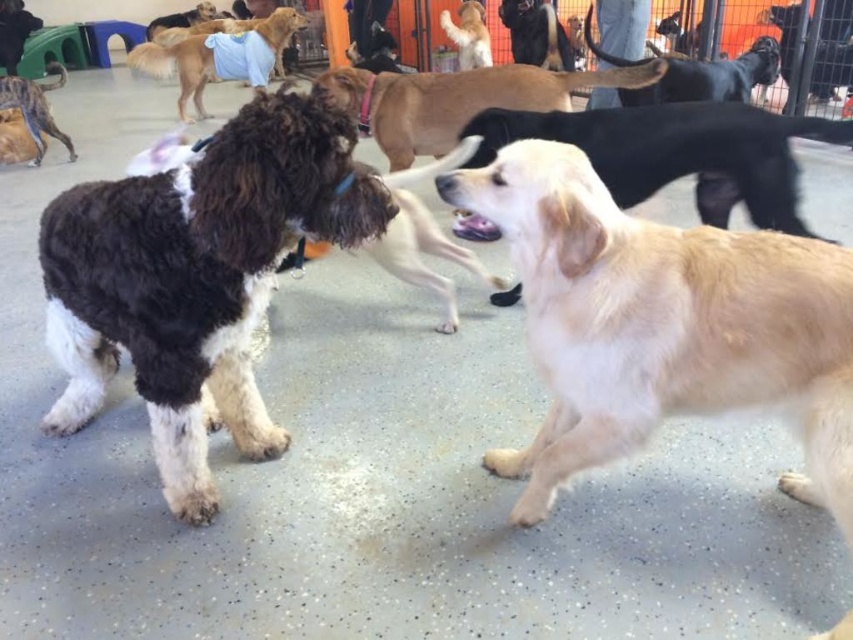
Between brown fur dog at upper left and golden fur dog at upper center, which one has more height?

brown fur dog at upper left is taller.

Between point (30, 132) and point (473, 26), which one is positioned in front?

Point (30, 132) is in front.

Who is more distant from viewer, [7,99] or [482,60]?

Positioned behind is point [482,60].

Identify the location of brown fur dog at upper left. (35, 108).

Between brown furry dog at center and brown fur dog at upper left, which one appears on the left side from the viewer's perspective?

Positioned to the left is brown fur dog at upper left.

Is brown furry dog at center positioned at the back of brown fur dog at upper left?

No, it is in front of brown fur dog at upper left.

Does point (422, 99) come closer to viewer compared to point (44, 97)?

Yes, point (422, 99) is in front of point (44, 97).

Locate an element on the screen. brown furry dog at center is located at coordinates (457, 99).

Consider the image. Which of these two, golden smooth coat at right or brown fur dog at upper left, stands taller?

golden smooth coat at right is taller.

Is golden smooth coat at right thinner than brown fur dog at upper left?

In fact, golden smooth coat at right might be wider than brown fur dog at upper left.

Between point (527, 524) and point (1, 93), which one is positioned behind?

Point (1, 93)

This screenshot has width=853, height=640. What are the coordinates of `golden smooth coat at right` in the screenshot? It's located at (662, 324).